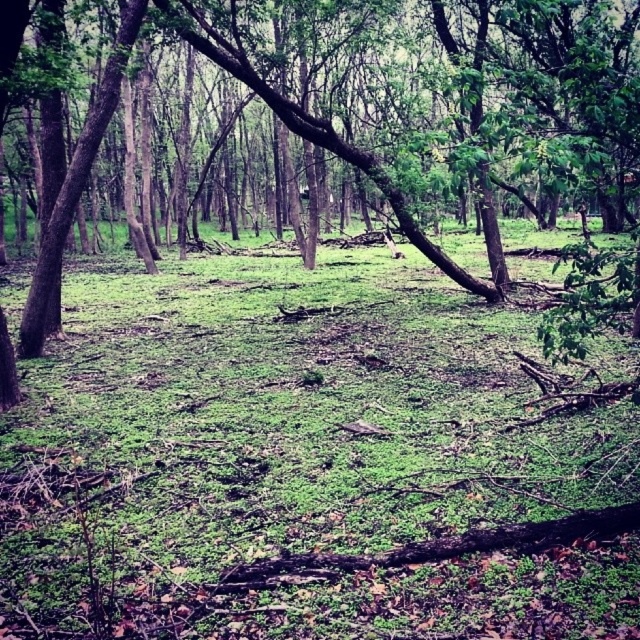
Between point (432, 394) and point (611, 308), which one is positioned in front?

Positioned in front is point (611, 308).

Which of these two, green mossy ground at center or green leafy tree at center, stands taller?

Standing taller between the two is green leafy tree at center.

At what (x,y) coordinates should I click in order to perform the action: click on green mossy ground at center. Please return your answer as a coordinate pair (x, y). Looking at the image, I should click on (300, 460).

Image resolution: width=640 pixels, height=640 pixels. I want to click on green mossy ground at center, so click(x=300, y=460).